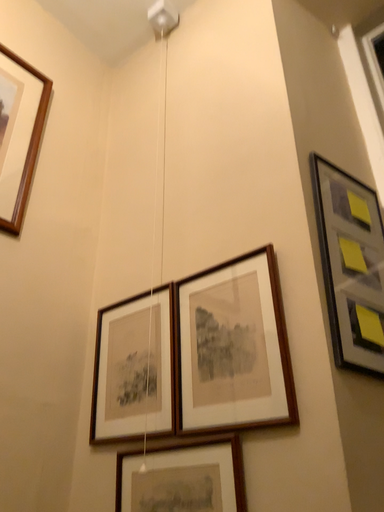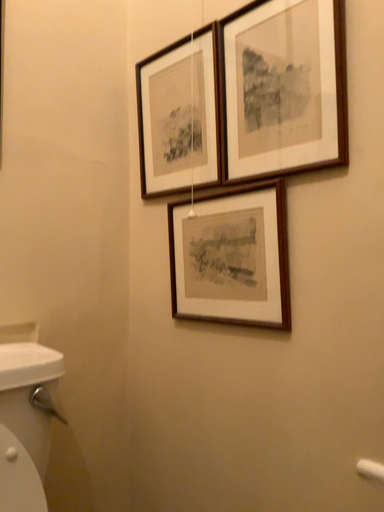
Question: How did the camera likely rotate when shooting the video?

Choices:
 (A) rotated upward
 (B) rotated downward

Answer: (B)